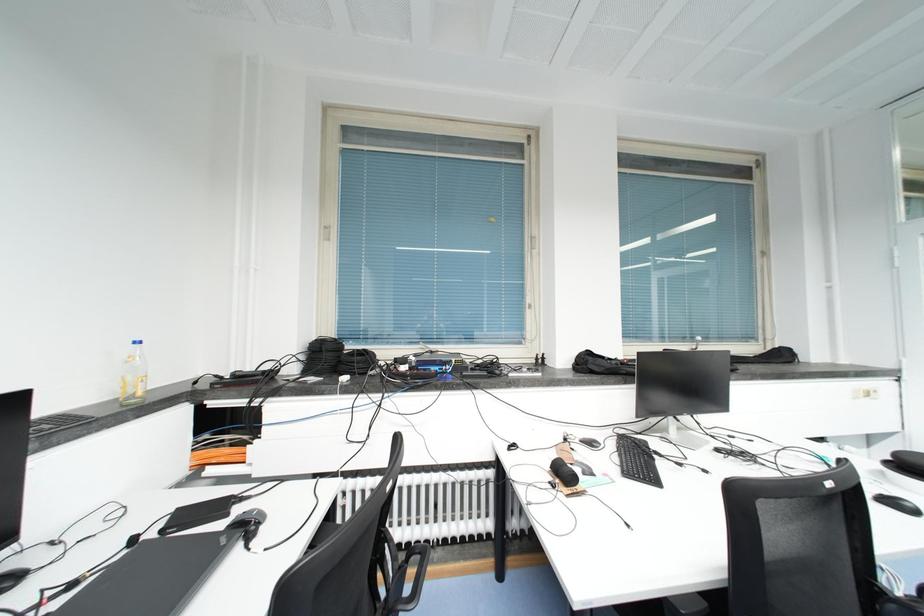
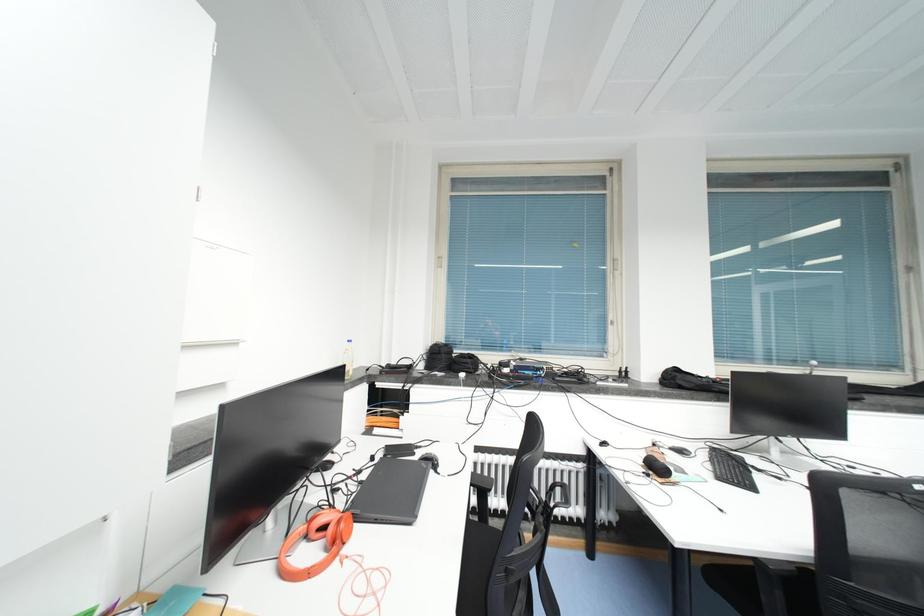
In a continuous first-person perspective shot, in which direction is the camera moving?

The cameraman walked toward left, backward.